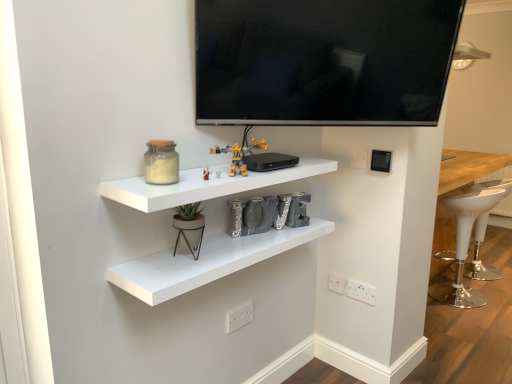
The height and width of the screenshot is (384, 512). In order to click on free space that is to the left of yellow plastic toy at center, which is counted as the third toy, starting from the left in this screenshot , I will do `click(190, 170)`.